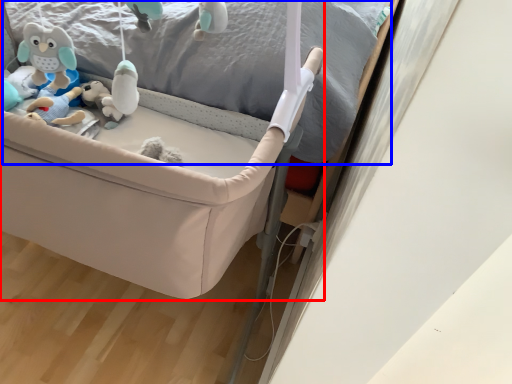
Question: Which object is closer to the camera taking this photo, infant bed (highlighted by a red box) or bed frame (highlighted by a blue box)?

Choices:
 (A) infant bed
 (B) bed frame

Answer: (B)